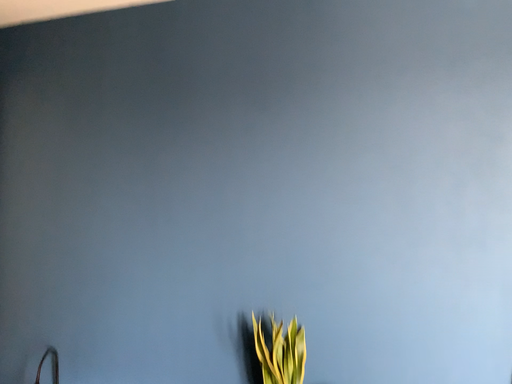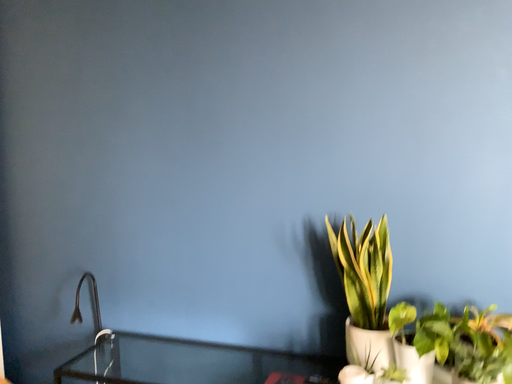
Question: Which way did the camera rotate in the video?

Choices:
 (A) rotated downward
 (B) rotated upward

Answer: (A)